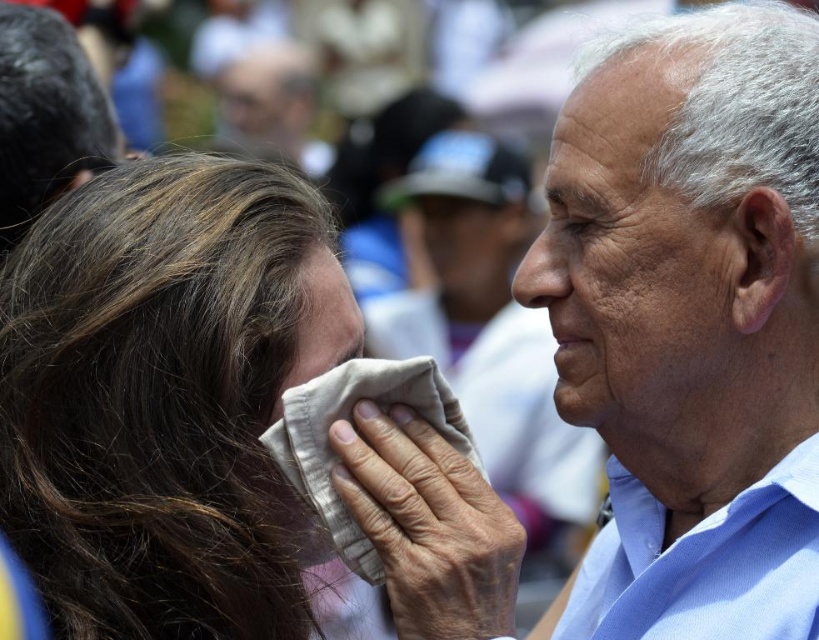
Looking at the scene, can you determine if the smooth beige cloth at center is in front of or behind the smooth skin face at right?

The smooth beige cloth at center is behind the smooth skin face at right.

Looking at the scene, which object is positioned higher up compared to the other? Please consider the smooth skin face at right and the smooth beige cloth at center in your answer.

The smooth skin face at right is positioned higher up than the smooth beige cloth at center.